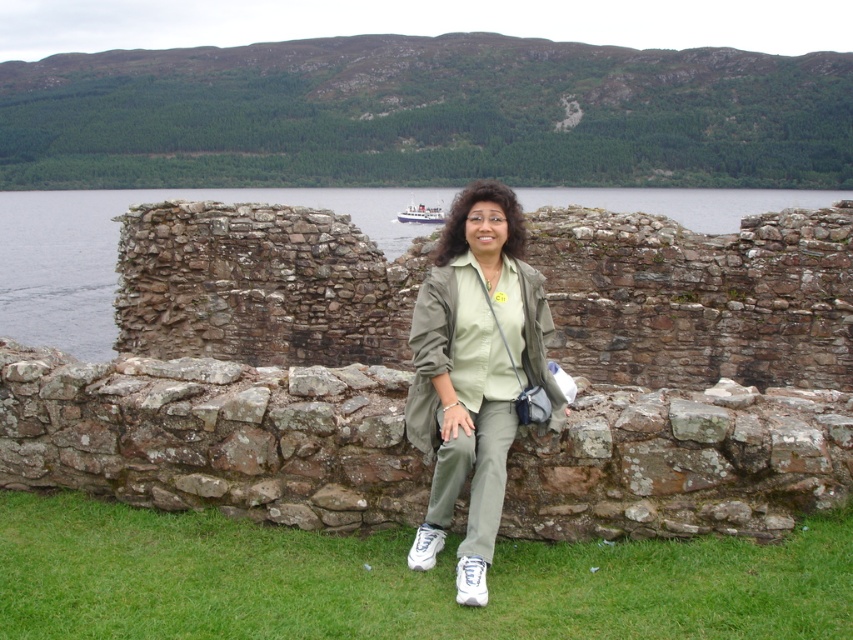
Question: Which of the following is the farthest from the observer?

Choices:
 (A) clear water at center
 (B) green grass at lower center
 (C) olive green fabric at center
 (D) brushed metal boat at upper center

Answer: (D)

Question: Can you confirm if green grass at lower center is positioned below brushed metal boat at upper center?

Choices:
 (A) yes
 (B) no

Answer: (A)

Question: Which point appears farthest from the camera in this image?

Choices:
 (A) (410, 208)
 (B) (39, 339)
 (C) (653, 541)
 (D) (460, 308)

Answer: (A)

Question: Which point is closer to the camera?

Choices:
 (A) brushed metal boat at upper center
 (B) clear water at center

Answer: (B)

Question: Where is green grass at lower center located in relation to clear water at center in the image?

Choices:
 (A) right
 (B) left

Answer: (B)

Question: Can you confirm if olive green fabric at center is bigger than brushed metal boat at upper center?

Choices:
 (A) no
 (B) yes

Answer: (A)